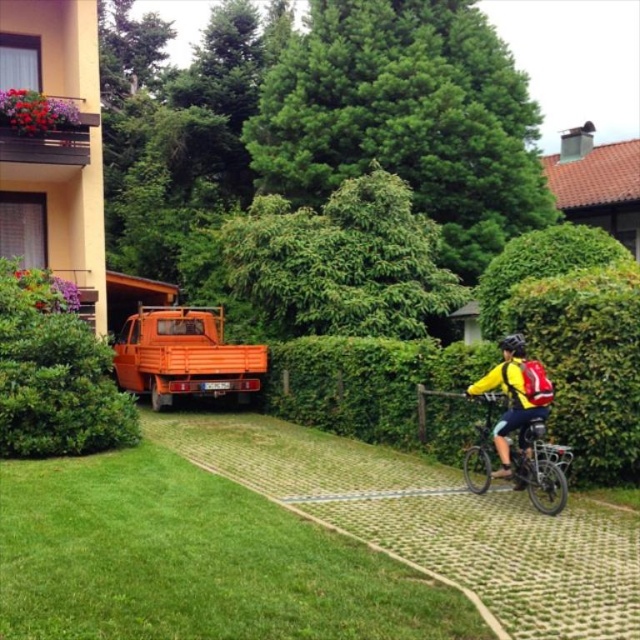
Question: From the image, what is the correct spatial relationship of green leafy hedge at left in relation to orange matte truck at center?

Choices:
 (A) left
 (B) right

Answer: (A)

Question: Can you confirm if green leafy hedge at left is positioned below orange matte truck at center?

Choices:
 (A) no
 (B) yes

Answer: (A)

Question: Is green leafy hedge at left further to camera compared to yellow fabric backpack at right?

Choices:
 (A) no
 (B) yes

Answer: (B)

Question: Estimate the real-world distances between objects in this image. Which object is closer to the black matte bicycle helmet at center?

Choices:
 (A) yellow fabric backpack at right
 (B) orange matte truck at center

Answer: (A)

Question: Which object is farther from the camera taking this photo?

Choices:
 (A) yellow fabric backpack at right
 (B) black matte bicycle helmet at center
 (C) orange matte truck at center

Answer: (C)

Question: Estimate the real-world distances between objects in this image. Which object is closer to the black matte bicycle helmet at center?

Choices:
 (A) orange matte truck at center
 (B) yellow fabric backpack at right
 (C) green leafy hedge at left
 (D) metallic silver bicycle at right

Answer: (B)